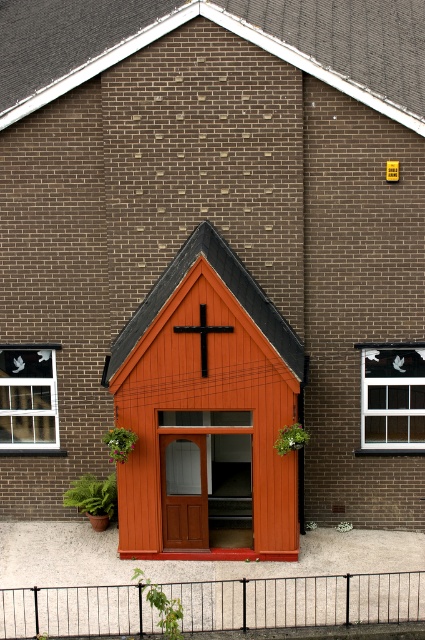
Can you confirm if white textured window at upper right is positioned above black matte cross at center?

No.

The height and width of the screenshot is (640, 425). Find the location of `white textured window at upper right`. white textured window at upper right is located at coordinates (393, 397).

Who is more distant from viewer, (x=380, y=392) or (x=204, y=339)?

The point (x=380, y=392) is behind.

I want to click on white textured window at upper right, so click(393, 397).

Is matte wood chapel at center positioned in front of clear glass window at left?

Yes, it is in front of clear glass window at left.

Does matte wood chapel at center have a larger size compared to clear glass window at left?

Indeed, matte wood chapel at center has a larger size compared to clear glass window at left.

Measure the distance between matte wood chapel at center and camera.

A: matte wood chapel at center is 20.16 meters away from camera.

Locate an element on the screen. This screenshot has width=425, height=640. matte wood chapel at center is located at coordinates (206, 410).

Measure the distance between white textured window at upper right and camera.

white textured window at upper right is 73.63 feet from camera.

In the scene shown: Is white textured window at upper right closer to camera compared to clear glass window at left?

Yes, white textured window at upper right is in front of clear glass window at left.

Is point (419, 381) farther from camera compared to point (8, 403)?

No, it is not.

Identify the location of white textured window at upper right. (393, 397).